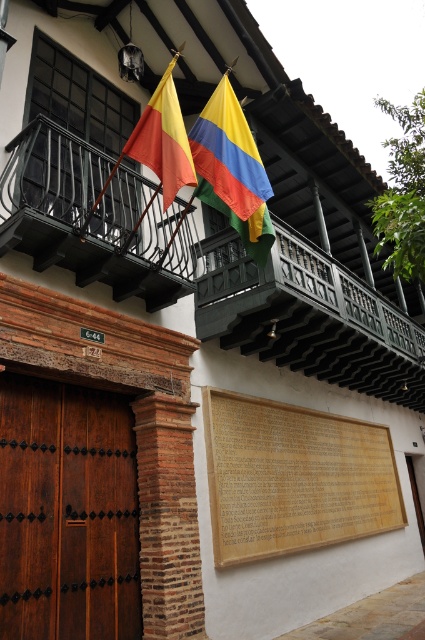
Between yellow-green striped flag at center and matte yellow flag at upper center, which one has less height?

Standing shorter between the two is matte yellow flag at upper center.

Does yellow-green striped flag at center appear on the right side of matte yellow flag at upper center?

Correct, you'll find yellow-green striped flag at center to the right of matte yellow flag at upper center.

Is point (224, 168) in front of point (141, 120)?

No, it is behind (141, 120).

Identify the location of yellow-green striped flag at center. (232, 170).

Can you confirm if black wrought iron balcony at upper left is positioned below matte yellow flag at upper center?

Indeed, black wrought iron balcony at upper left is positioned under matte yellow flag at upper center.

Is black wrought iron balcony at upper left to the left of matte yellow flag at upper center from the viewer's perspective?

In fact, black wrought iron balcony at upper left is to the right of matte yellow flag at upper center.

Is point (370, 291) positioned after point (181, 128)?

Yes.

At what (x,y) coordinates should I click in order to perform the action: click on black wrought iron balcony at upper left. Please return your answer as a coordinate pair (x, y). This screenshot has width=425, height=640. Looking at the image, I should click on (206, 269).

Who is lower down, black wrought iron balcony at upper left or yellow-green striped flag at center?

black wrought iron balcony at upper left

Does black wrought iron balcony at upper left have a lesser width compared to yellow-green striped flag at center?

Indeed, black wrought iron balcony at upper left has a lesser width compared to yellow-green striped flag at center.

What do you see at coordinates (206, 269) in the screenshot?
I see `black wrought iron balcony at upper left` at bounding box center [206, 269].

Find the location of a particular element. The width and height of the screenshot is (425, 640). black wrought iron balcony at upper left is located at coordinates (206, 269).